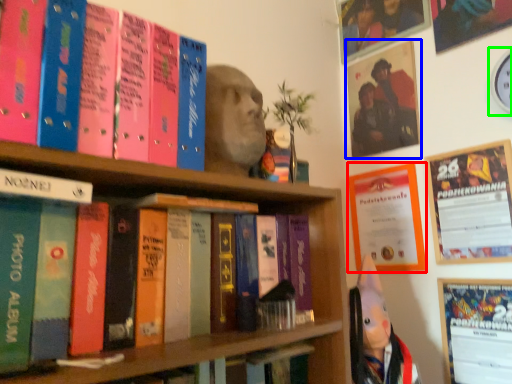
Question: Which is nearer to the poster page (highlighted by a red box)? picture frame (highlighted by a blue box) or clock (highlighted by a green box).

Choices:
 (A) picture frame
 (B) clock

Answer: (A)